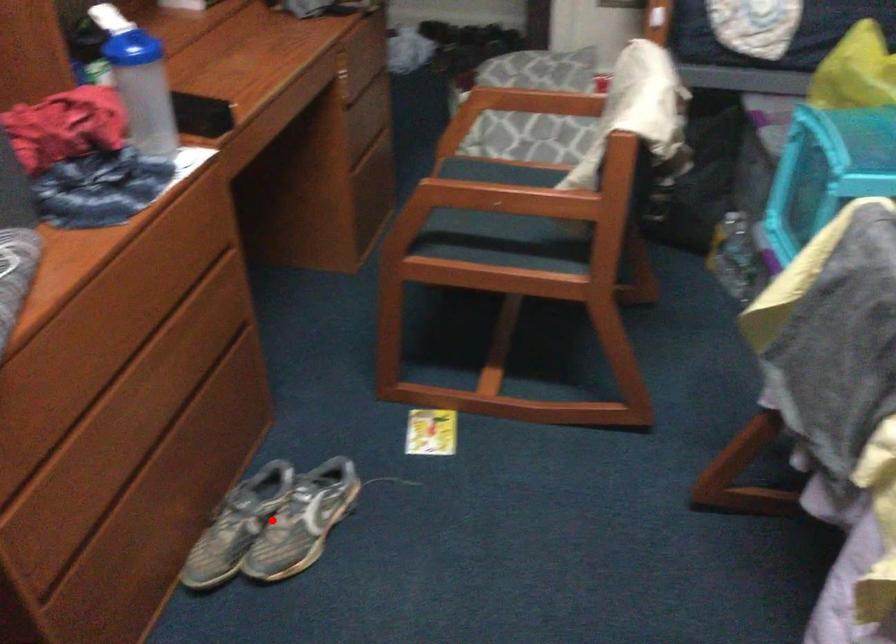
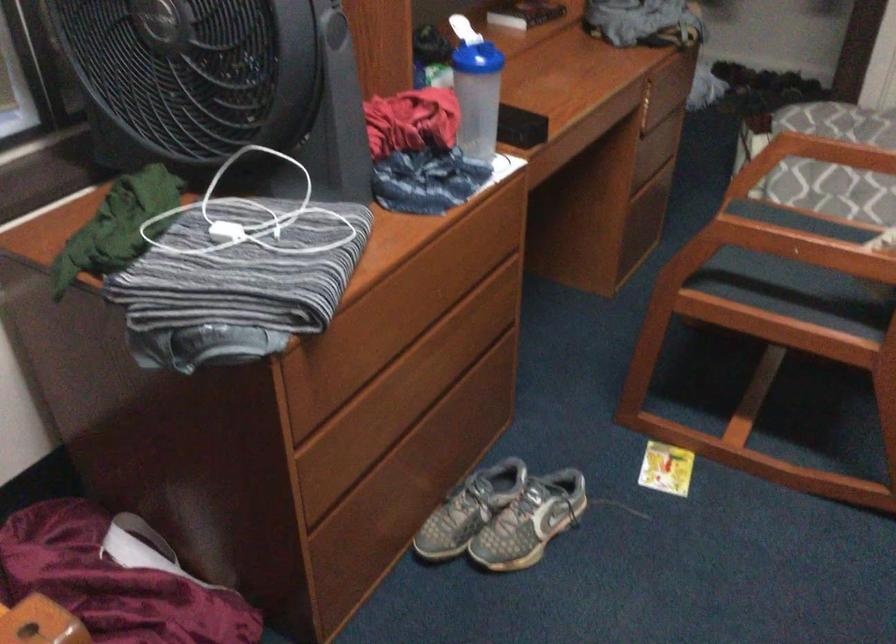
Where in the second image is the point corresponding to the highlighted location from the first image?

(503, 516)